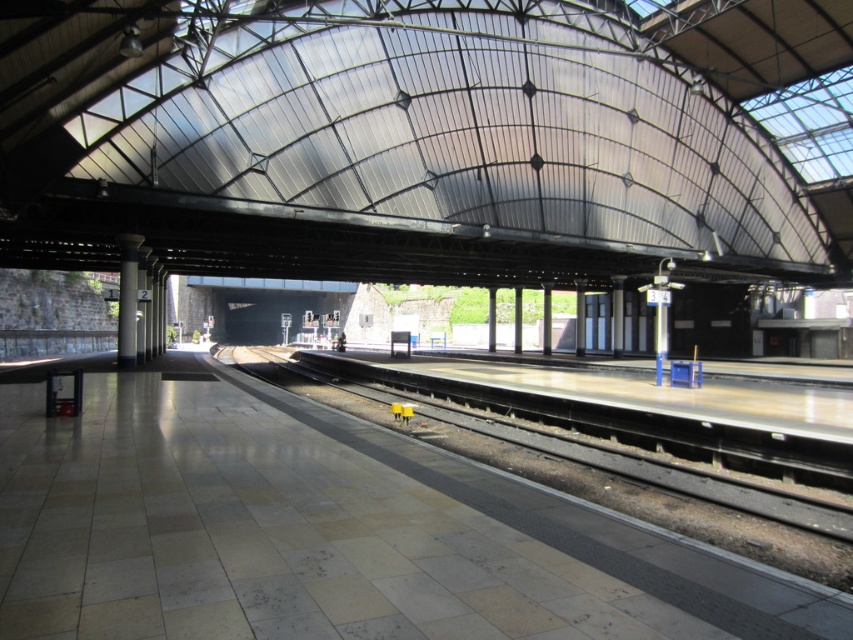
You are standing on the train station platform and want to know which of the two points, point (521, 632) or point (132, 250), is closer to you. Can you determine this based on the scene?

Point (521, 632) is closer to the viewer than point (132, 250).